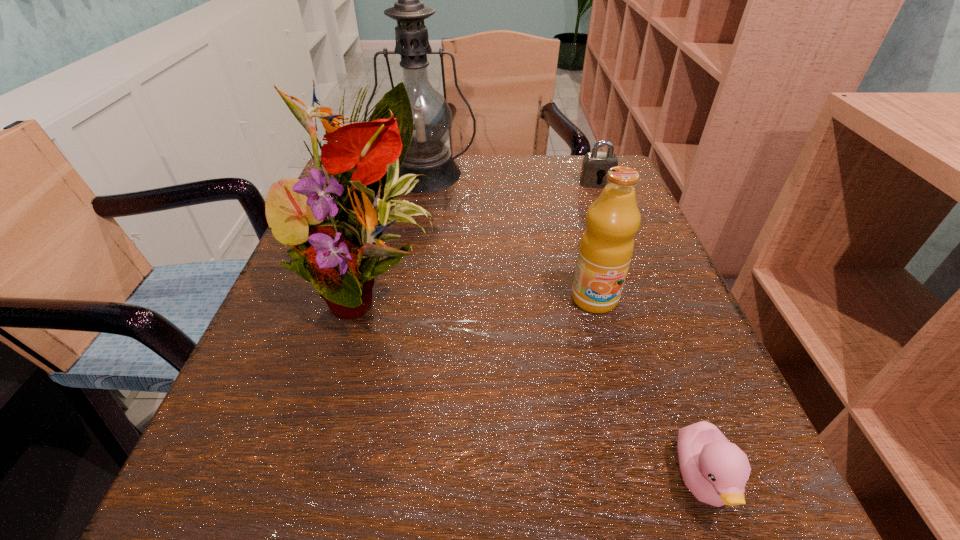
Find the location of `free space between the bouquet and the fruit juice`. free space between the bouquet and the fruit juice is located at coordinates (483, 294).

The width and height of the screenshot is (960, 540). In order to click on empty space that is in between the oil lamp and the padlock in this screenshot , I will do `click(511, 178)`.

Find the location of a particular element. blank region between the padlock and the bouquet is located at coordinates (484, 236).

Locate an element on the screen. empty location between the nearest object and the bouquet is located at coordinates (537, 385).

Locate an element on the screen. This screenshot has height=540, width=960. vacant region between the oil lamp and the third shortest object is located at coordinates (510, 236).

Where is `blank region between the fruit juice and the oil lamp`? blank region between the fruit juice and the oil lamp is located at coordinates (510, 236).

The height and width of the screenshot is (540, 960). I want to click on the closest object relative to the fruit juice, so click(715, 470).

Select which object is the third closest to the padlock. Please provide its 2D coordinates. Your answer should be formatted as a tuple, i.e. [(x, y)], where the tuple contains the x and y coordinates of a point satisfying the conditions above.

[(333, 254)]